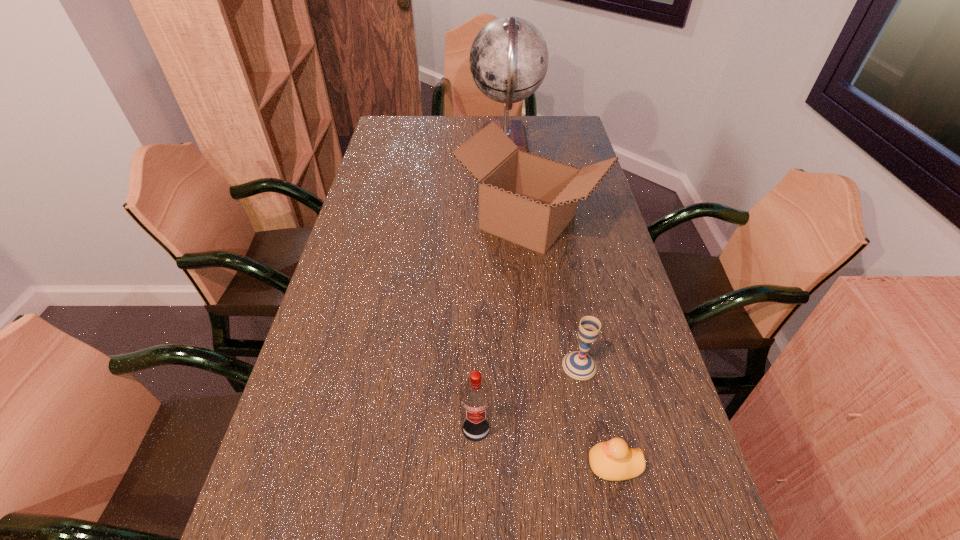
Image resolution: width=960 pixels, height=540 pixels. Identify the location of box located in the right edge section of the desktop. (529, 200).

At what (x,y) coordinates should I click in order to perform the action: click on chalice located at the right edge. Please return your answer as a coordinate pair (x, y). Looking at the image, I should click on (579, 365).

Where is `duck located at the right edge`? duck located at the right edge is located at coordinates pyautogui.click(x=613, y=460).

In the image, there is a desktop. At what (x,y) coordinates should I click in order to perform the action: click on free region at the far edge. Please return your answer as a coordinate pair (x, y). Looking at the image, I should click on (479, 126).

This screenshot has width=960, height=540. What are the coordinates of `vacant space at the left edge of the desktop` in the screenshot? It's located at (357, 219).

Locate an element on the screen. free region at the right edge of the desktop is located at coordinates (624, 280).

The width and height of the screenshot is (960, 540). In the image, there is a desktop. Identify the location of vacant space at the far left corner. (416, 134).

Find the location of `unoccupied position between the second shortest object and the third tallest object`. unoccupied position between the second shortest object and the third tallest object is located at coordinates (528, 397).

Identify the location of vacant point located between the vodka and the shortest object. This screenshot has width=960, height=540. (545, 447).

I want to click on free space between the duck and the box, so click(x=571, y=343).